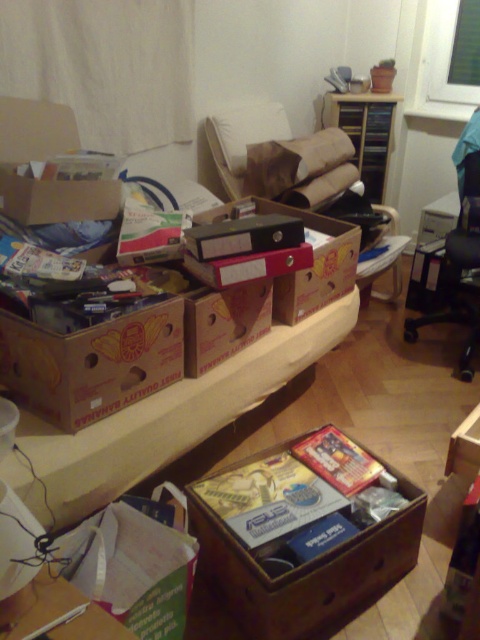
Question: Can you confirm if brown cardboard box at center is wider than black plastic swivel chair at right?

Choices:
 (A) no
 (B) yes

Answer: (B)

Question: From the image, what is the correct spatial relationship of wooden box at center in relation to brown cardboard boxes at center?

Choices:
 (A) right
 (B) left

Answer: (A)

Question: Considering the real-world distances, which object is closest to the brown cardboard swivel chair at center?

Choices:
 (A) brown cardboard box at center
 (B) black plastic swivel chair at right

Answer: (B)

Question: Which of the following is the closest to the observer?

Choices:
 (A) brown cardboard swivel chair at center
 (B) black plastic swivel chair at right

Answer: (B)

Question: Does brown cardboard box at center lie behind black plastic swivel chair at right?

Choices:
 (A) yes
 (B) no

Answer: (B)

Question: Which point is farther from the camera taking this photo?

Choices:
 (A) (383, 300)
 (B) (478, 131)

Answer: (A)